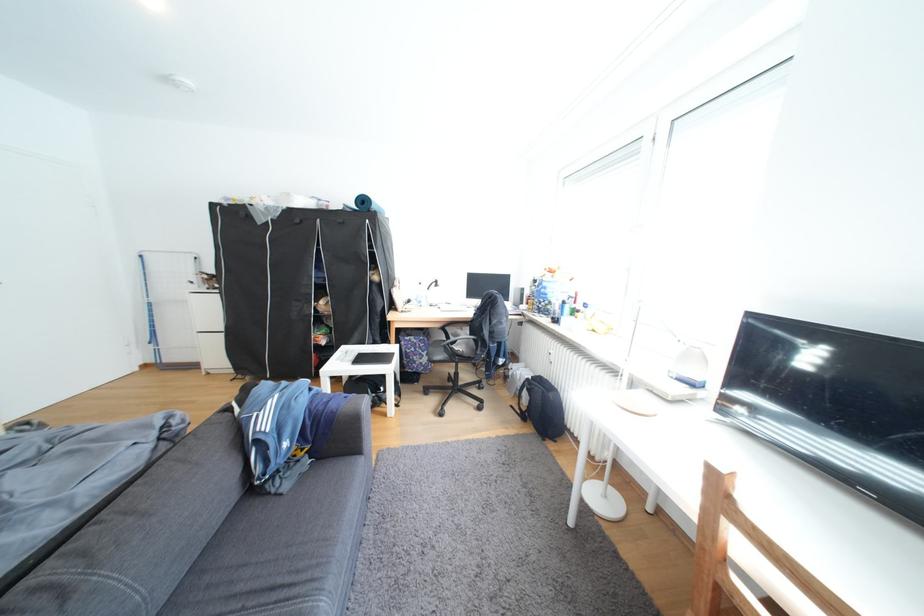
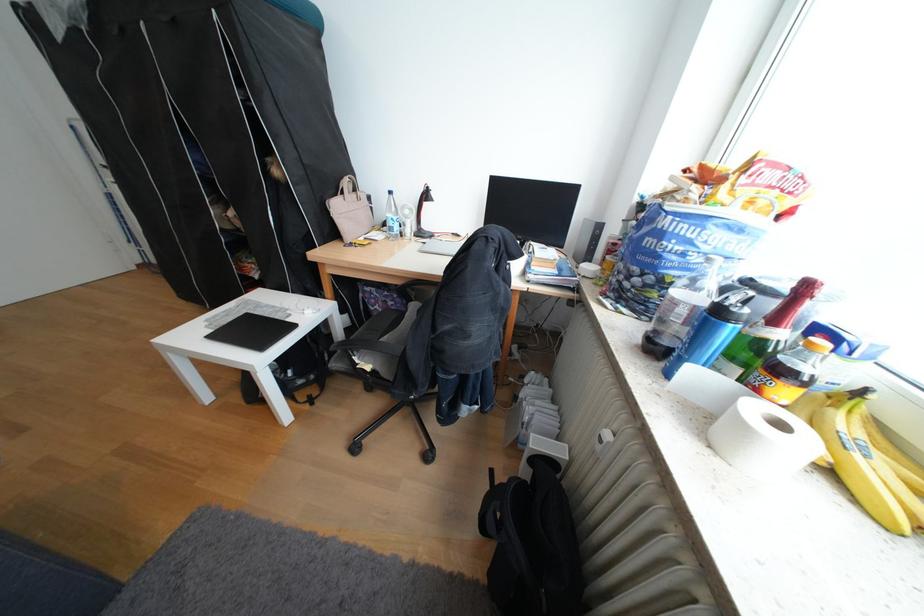
Locate, in the second image, the point that corresponds to [531,373] in the first image.

(541, 410)